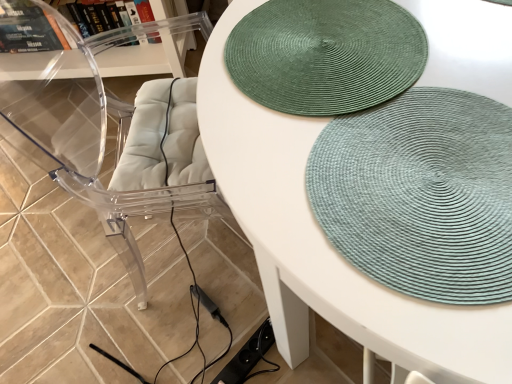
Describe the element at coordinates (325, 55) in the screenshot. I see `green woven mat at upper center, the 2th mat ordered from the bottom` at that location.

At what (x,y) coordinates should I click in order to perform the action: click on green woven placemat at upper center. Please return your answer as a coordinate pair (x, y). Looking at the image, I should click on (326, 243).

Identify the location of transparent plastic shelf at upper left. (148, 56).

Between transparent plastic shelf at upper left and green woven placemat at upper center, which one has smaller size?

transparent plastic shelf at upper left.

Which object is closer to the camera, transparent plastic shelf at upper left or green woven placemat at upper center?

green woven placemat at upper center.

Can you confirm if transparent plastic shelf at upper left is wider than green woven placemat at upper center?

No.

Consider the image. Is transparent plastic shelf at upper left positioned with its back to green woven placemat at upper center?

transparent plastic shelf at upper left is not turned away from green woven placemat at upper center.

Which is closer, (459,144) or (101,75)?

Point (459,144) is positioned closer to the camera compared to point (101,75).

Is the position of green woven mat at upper right, the first mat in the bottom-to-top sequence, less distant than that of transparent plastic shelf at upper left?

Yes, green woven mat at upper right, the first mat in the bottom-to-top sequence, is in front of transparent plastic shelf at upper left.

Is the surface of green woven mat at upper right, the first mat in the bottom-to-top sequence, in direct contact with transparent plastic shelf at upper left?

No, green woven mat at upper right, the first mat in the bottom-to-top sequence, is not beside transparent plastic shelf at upper left.

This screenshot has height=384, width=512. Find the location of `shelf above the green woven mat at upper right, marked as the second mat in a top-to-bottom arrangement (from the image's perspective)`. shelf above the green woven mat at upper right, marked as the second mat in a top-to-bottom arrangement (from the image's perspective) is located at coordinates (148, 56).

From a real-world perspective, between transparent acrylic swivel chair at left and green woven mat at upper center, the 2th mat ordered from the bottom, who is vertically lower?

transparent acrylic swivel chair at left is physically lower.

From the image's perspective, is transparent acrylic swivel chair at left located above or below green woven mat at upper center, the 2th mat ordered from the bottom?

transparent acrylic swivel chair at left is below green woven mat at upper center, the 2th mat ordered from the bottom.

Can we say green woven placemat at upper center lies outside green woven mat at upper right, marked as the second mat in a top-to-bottom arrangement?

That's correct, green woven placemat at upper center is outside of green woven mat at upper right, marked as the second mat in a top-to-bottom arrangement.

In the scene shown: Is green woven placemat at upper center positioned in front of green woven mat at upper right, the first mat in the bottom-to-top sequence?

No, green woven placemat at upper center is behind green woven mat at upper right, the first mat in the bottom-to-top sequence.

Could you tell me if green woven placemat at upper center is turned towards green woven mat at upper right, the first mat in the bottom-to-top sequence?

No, green woven placemat at upper center is not aimed at green woven mat at upper right, the first mat in the bottom-to-top sequence.

Who is taller, green woven placemat at upper center or green woven mat at upper right, the first mat in the bottom-to-top sequence?

With more height is green woven mat at upper right, the first mat in the bottom-to-top sequence.

Does green woven mat at upper center, the 2th mat ordered from the bottom, have a larger size compared to green woven placemat at upper center?

No, green woven mat at upper center, the 2th mat ordered from the bottom, is not bigger than green woven placemat at upper center.

Is green woven mat at upper center, the 2th mat ordered from the bottom, turned away from green woven placemat at upper center?

Yes, green woven mat at upper center, the 2th mat ordered from the bottom, is facing away from green woven placemat at upper center.

Is green woven mat at upper center, which is the first mat from top to bottom, not close to green woven placemat at upper center?

green woven mat at upper center, which is the first mat from top to bottom, is near green woven placemat at upper center, not far away.

Between green woven placemat at upper center and transparent acrylic swivel chair at left, which one has smaller width?

Thinner between the two is transparent acrylic swivel chair at left.

Is green woven placemat at upper center not near transparent acrylic swivel chair at left?

green woven placemat at upper center is near transparent acrylic swivel chair at left, not far away.

Between green woven placemat at upper center and transparent acrylic swivel chair at left, which one has larger size?

green woven placemat at upper center.

Is green woven placemat at upper center situated inside transparent acrylic swivel chair at left or outside?

green woven placemat at upper center lies outside transparent acrylic swivel chair at left.

Would you consider green woven placemat at upper center to be distant from green woven mat at upper center, the 2th mat ordered from the bottom?

That's not correct — green woven placemat at upper center is a little close to green woven mat at upper center, the 2th mat ordered from the bottom.

From a real-world perspective, which is physically above, green woven placemat at upper center or green woven mat at upper center, the 2th mat ordered from the bottom?

green woven mat at upper center, the 2th mat ordered from the bottom.

Could you measure the distance between green woven placemat at upper center and green woven mat at upper center, which is the first mat from top to bottom?

green woven placemat at upper center and green woven mat at upper center, which is the first mat from top to bottom, are 12.19 centimeters apart from each other.

Between point (372, 322) and point (272, 40), which one is positioned behind?

The point (272, 40) is farther.

This screenshot has height=384, width=512. Find the location of `shelf on the left of green woven placemat at upper center`. shelf on the left of green woven placemat at upper center is located at coordinates (148, 56).

Image resolution: width=512 pixels, height=384 pixels. In order to click on shelf below the green woven mat at upper right, marked as the second mat in a top-to-bottom arrangement (from a real-world perspective) in this screenshot , I will do `click(148, 56)`.

When comparing their distances from transparent acrylic swivel chair at left, does green woven placemat at upper center or green woven mat at upper right, marked as the second mat in a top-to-bottom arrangement, seem closer?

green woven placemat at upper center is positioned closer to the anchor transparent acrylic swivel chair at left.

When comparing their distances from green woven mat at upper right, marked as the second mat in a top-to-bottom arrangement, does transparent plastic shelf at upper left or green woven placemat at upper center seem closer?

green woven placemat at upper center.

From the image, which object appears to be nearer to green woven mat at upper right, marked as the second mat in a top-to-bottom arrangement, green woven mat at upper center, the 2th mat ordered from the bottom, or green woven placemat at upper center?

green woven placemat at upper center lies closer to green woven mat at upper right, marked as the second mat in a top-to-bottom arrangement, than the other object.

Estimate the real-world distances between objects in this image. Which object is closer to green woven placemat at upper center, green woven mat at upper right, the first mat in the bottom-to-top sequence, or transparent plastic shelf at upper left?

green woven mat at upper right, the first mat in the bottom-to-top sequence, lies closer to green woven placemat at upper center than the other object.

From the image, which object appears to be farther from green woven mat at upper right, the first mat in the bottom-to-top sequence, transparent acrylic swivel chair at left or transparent plastic shelf at upper left?

The object further to green woven mat at upper right, the first mat in the bottom-to-top sequence, is transparent plastic shelf at upper left.

Considering their positions, is transparent acrylic swivel chair at left positioned further to green woven mat at upper center, which is the first mat from top to bottom, than green woven mat at upper right, marked as the second mat in a top-to-bottom arrangement?

transparent acrylic swivel chair at left is further to green woven mat at upper center, which is the first mat from top to bottom.

Based on their spatial positions, is green woven mat at upper right, the first mat in the bottom-to-top sequence, or green woven mat at upper center, which is the first mat from top to bottom, further from transparent acrylic swivel chair at left?

Based on the image, green woven mat at upper right, the first mat in the bottom-to-top sequence, appears to be further to transparent acrylic swivel chair at left.

Looking at the image, which one is located closer to green woven mat at upper center, the 2th mat ordered from the bottom, transparent plastic shelf at upper left or green woven placemat at upper center?

green woven placemat at upper center is positioned closer to the anchor green woven mat at upper center, the 2th mat ordered from the bottom.

You are a GUI agent. You are given a task and a screenshot of the screen. Output one action in this format:
    pyautogui.click(x=<x>, y=<y>)
    Task: Click on the mat between transparent acrylic swivel chair at left and green woven mat at upper right, the first mat in the bottom-to-top sequence, from left to right
    Image resolution: width=512 pixels, height=384 pixels.
    Given the screenshot: What is the action you would take?
    pyautogui.click(x=325, y=55)

Where is `table between green woven mat at upper center, which is the first mat from top to bottom, and green woven mat at upper right, the first mat in the bottom-to-top sequence, vertically`? table between green woven mat at upper center, which is the first mat from top to bottom, and green woven mat at upper right, the first mat in the bottom-to-top sequence, vertically is located at coordinates (326, 243).

Image resolution: width=512 pixels, height=384 pixels. In order to click on table between green woven mat at upper right, marked as the second mat in a top-to-bottom arrangement, and transparent plastic shelf at upper left from front to back in this screenshot , I will do `click(326, 243)`.

Find the location of `mat located between transparent acrylic swivel chair at left and transparent plastic shelf at upper left in the depth direction`. mat located between transparent acrylic swivel chair at left and transparent plastic shelf at upper left in the depth direction is located at coordinates (325, 55).